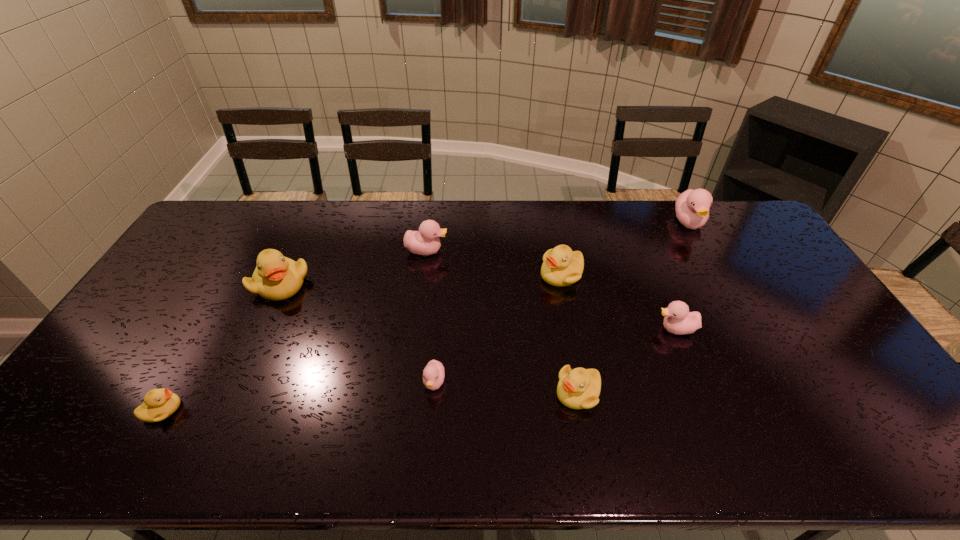
The image size is (960, 540). In the image, there is a desktop. Identify the location of vacant space at the right edge. (876, 427).

This screenshot has width=960, height=540. What are the coordinates of `free location at the far left corner` in the screenshot? It's located at (228, 204).

This screenshot has height=540, width=960. What are the coordinates of `vacant space at the far right corner` in the screenshot? It's located at (713, 219).

I want to click on vacant space that's between the third pink duckling from left to right and the rightmost duckling, so click(x=683, y=276).

Identify the location of vacant point located between the second farthest pink duckling and the seventh duckling from right to left. (353, 267).

Locate an element on the screen. The image size is (960, 540). free space between the smallest yellow duckling and the smallest pink duckling is located at coordinates (299, 396).

Identify the location of free spot between the second duckling from left to right and the second duckling from right to left. This screenshot has width=960, height=540. (478, 306).

Identify the location of free space between the second object from left to right and the leftmost yellow duckling. Image resolution: width=960 pixels, height=540 pixels. (222, 347).

Locate an element on the screen. Image resolution: width=960 pixels, height=540 pixels. vacant space that's between the nearest pink duckling and the seventh duckling from right to left is located at coordinates (357, 333).

Locate an element on the screen. The width and height of the screenshot is (960, 540). vacant space that's between the farthest pink duckling and the fourth nearest duckling is located at coordinates click(683, 276).